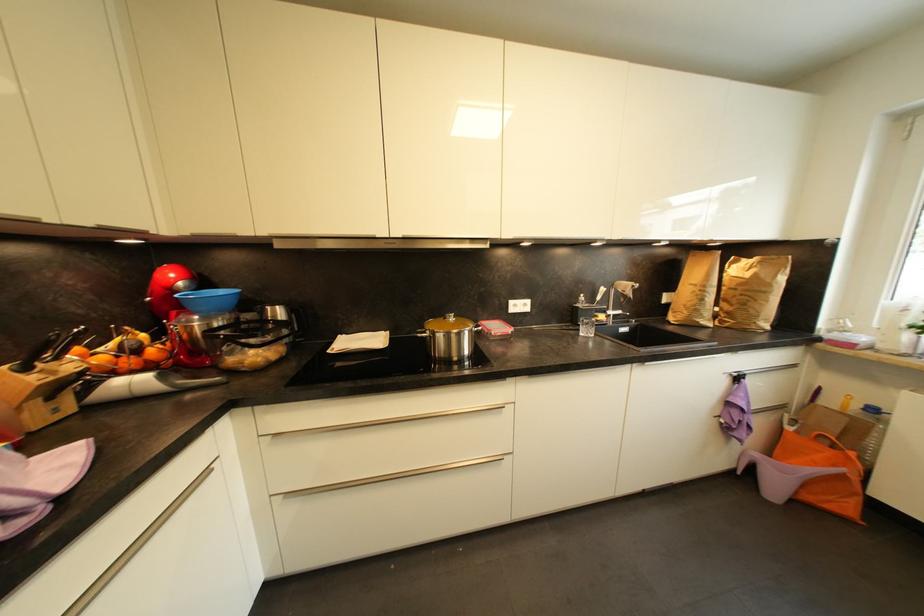
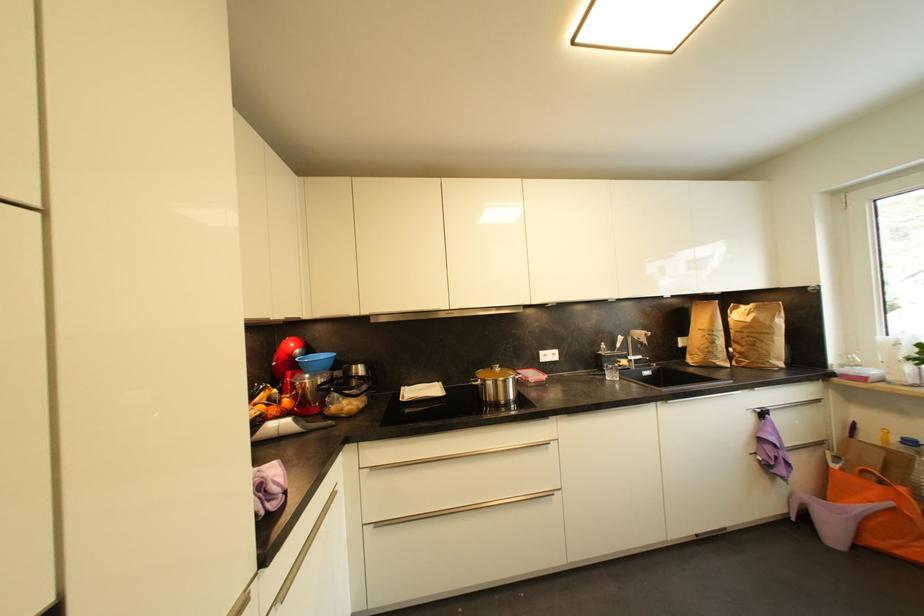
In the second image, find the point that corresponds to point (744, 286) in the first image.

(748, 330)